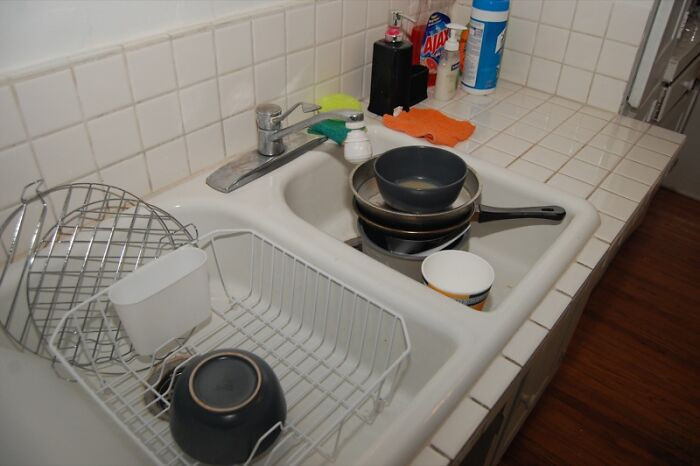
You are a GUI agent. You are given a task and a screenshot of the screen. Output one action in this format:
    pyautogui.click(x=<x>, y=<y>)
    Task: Click on the hand soap
    
    Given the screenshot: What is the action you would take?
    pyautogui.click(x=447, y=72), pyautogui.click(x=390, y=32)